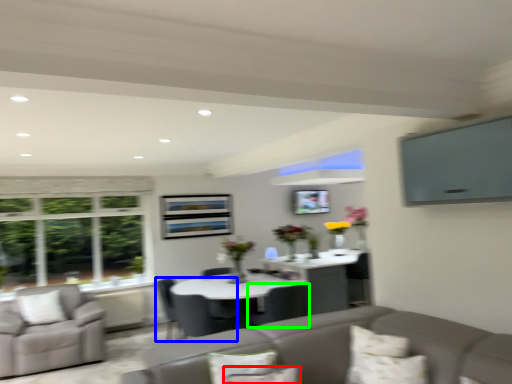
Question: Which object is positioned closest to pillow (highlighted by a red box)? Select from chair (highlighted by a blue box) and chair (highlighted by a green box).

Choices:
 (A) chair
 (B) chair

Answer: (B)